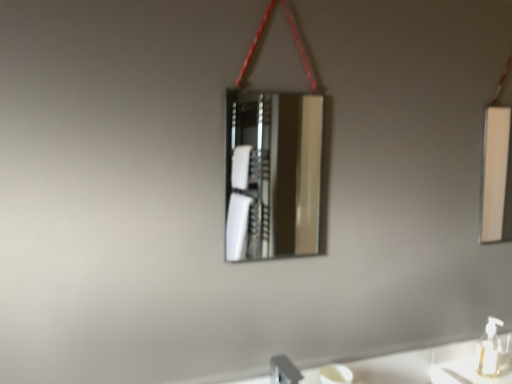
Measure the distance between silver metallic faucet at lower center and camera.

The distance of silver metallic faucet at lower center from camera is 3.58 feet.

What do you see at coordinates (490, 351) in the screenshot? Image resolution: width=512 pixels, height=384 pixels. I see `white plastic soap dispenser at lower right` at bounding box center [490, 351].

Find the location of `polished silver mirror at center, which ranks as the first mirror in front-to-back order`. polished silver mirror at center, which ranks as the first mirror in front-to-back order is located at coordinates (272, 174).

Are white glossy mirror at right, the 1th mirror when ordered from back to front, and silver metallic faucet at lower center beside each other?

No, white glossy mirror at right, the 1th mirror when ordered from back to front, is not in contact with silver metallic faucet at lower center.

Is white glossy mirror at right, the 1th mirror when ordered from back to front, located outside silver metallic faucet at lower center?

Yes.

How much distance is there between white glossy mirror at right, arranged as the 2th mirror when viewed from the left, and silver metallic faucet at lower center?

white glossy mirror at right, arranged as the 2th mirror when viewed from the left, and silver metallic faucet at lower center are 2.68 meters apart from each other.

Is white glossy mirror at right, the 1th mirror when ordered from back to front, positioned with its back to silver metallic faucet at lower center?

No.

Considering the sizes of polished silver mirror at center, placed as the first mirror when sorted from left to right, and white plastic soap dispenser at lower right in the image, is polished silver mirror at center, placed as the first mirror when sorted from left to right, wider or thinner than white plastic soap dispenser at lower right?

Considering their sizes, polished silver mirror at center, placed as the first mirror when sorted from left to right, looks slimmer than white plastic soap dispenser at lower right.

Between polished silver mirror at center, the 2th mirror from the right, and white plastic soap dispenser at lower right, which one has smaller size?

white plastic soap dispenser at lower right.

Looking at this image, can you confirm if polished silver mirror at center, placed as the second mirror when sorted from back to front, is taller than white plastic soap dispenser at lower right?

Correct, polished silver mirror at center, placed as the second mirror when sorted from back to front, is much taller as white plastic soap dispenser at lower right.

Is white plastic soap dispenser at lower right not near white glossy mirror at right, the 1th mirror when ordered from back to front?

white plastic soap dispenser at lower right is positioned a significant distance from white glossy mirror at right, the 1th mirror when ordered from back to front.

Considering the positions of objects white plastic soap dispenser at lower right and white glossy mirror at right, placed as the 2th mirror when sorted from front to back, in the image provided, who is behind, white plastic soap dispenser at lower right or white glossy mirror at right, placed as the 2th mirror when sorted from front to back,?

Positioned behind is white glossy mirror at right, placed as the 2th mirror when sorted from front to back.

From a real-world perspective, which is physically below, white plastic soap dispenser at lower right or white glossy mirror at right, placed as the 2th mirror when sorted from front to back?

white plastic soap dispenser at lower right is physically lower.

Considering the points (498, 372) and (488, 195), which point is in front, point (498, 372) or point (488, 195)?

The point (498, 372) is in front.

In the image, is polished silver mirror at center, placed as the second mirror when sorted from back to front, on the left side or the right side of white glossy mirror at right, arranged as the 2th mirror when viewed from the left?

In the image, polished silver mirror at center, placed as the second mirror when sorted from back to front, appears on the left side of white glossy mirror at right, arranged as the 2th mirror when viewed from the left.

Considering the sizes of objects polished silver mirror at center, placed as the second mirror when sorted from back to front, and white glossy mirror at right, placed as the 2th mirror when sorted from front to back, in the image provided, who is shorter, polished silver mirror at center, placed as the second mirror when sorted from back to front, or white glossy mirror at right, placed as the 2th mirror when sorted from front to back,?

Standing shorter between the two is white glossy mirror at right, placed as the 2th mirror when sorted from front to back.

Which is behind, point (240, 205) or point (480, 234)?

The point (240, 205) is more distant.

Considering the relative sizes of white glossy mirror at right, the 1th mirror when ordered from back to front, and polished silver mirror at center, placed as the first mirror when sorted from left to right, in the image provided, is white glossy mirror at right, the 1th mirror when ordered from back to front, shorter than polished silver mirror at center, placed as the first mirror when sorted from left to right,?

Yes.

Considering the relative positions of white glossy mirror at right, arranged as the 2th mirror when viewed from the left, and polished silver mirror at center, placed as the second mirror when sorted from back to front, in the image provided, is white glossy mirror at right, arranged as the 2th mirror when viewed from the left, to the left or to the right of polished silver mirror at center, placed as the second mirror when sorted from back to front,?

In the image, white glossy mirror at right, arranged as the 2th mirror when viewed from the left, appears on the right side of polished silver mirror at center, placed as the second mirror when sorted from back to front.

Is polished silver mirror at center, which ranks as the first mirror in front-to-back order, completely or partially inside white glossy mirror at right, the 1th mirror when ordered from back to front?

No.

From the image's perspective, which one is positioned lower, white glossy mirror at right, placed as the 2th mirror when sorted from front to back, or white plastic soap dispenser at lower right?

white plastic soap dispenser at lower right, from the image's perspective.

Which object is further away from the camera taking this photo, white glossy mirror at right, placed as the 2th mirror when sorted from front to back, or white plastic soap dispenser at lower right?

white glossy mirror at right, placed as the 2th mirror when sorted from front to back.

In the scene shown: Is white glossy mirror at right, placed as the first mirror when sorted from right to left, placed right next to white plastic soap dispenser at lower right?

No, white glossy mirror at right, placed as the first mirror when sorted from right to left, is not with white plastic soap dispenser at lower right.

Looking at this image, is white glossy mirror at right, arranged as the 2th mirror when viewed from the left, facing towards white plastic soap dispenser at lower right?

No, white glossy mirror at right, arranged as the 2th mirror when viewed from the left, does not turn towards white plastic soap dispenser at lower right.

Identify the location of soap dispenser positioned vertically above the silver metallic faucet at lower center (from a real-world perspective). (490, 351).

How much distance is there between silver metallic faucet at lower center and white plastic soap dispenser at lower right?

24.01 inches.

Does silver metallic faucet at lower center have a lesser height compared to white plastic soap dispenser at lower right?

Correct, silver metallic faucet at lower center is not as tall as white plastic soap dispenser at lower right.

From the image's perspective, which object appears higher, silver metallic faucet at lower center or white plastic soap dispenser at lower right?

From the image's view, white plastic soap dispenser at lower right is above.

Find the location of a particular element. This screenshot has height=384, width=512. faucet to the left of white glossy mirror at right, placed as the first mirror when sorted from right to left is located at coordinates (283, 371).

Locate an element on the screen. The image size is (512, 384). the 1st mirror above the white plastic soap dispenser at lower right (from a real-world perspective) is located at coordinates (272, 174).

Based on their spatial positions, is white plastic soap dispenser at lower right or white glossy mirror at right, the 1th mirror when ordered from back to front, closer to polished silver mirror at center, placed as the first mirror when sorted from left to right?

Among the two, white glossy mirror at right, the 1th mirror when ordered from back to front, is located nearer to polished silver mirror at center, placed as the first mirror when sorted from left to right.

Which object lies nearer to the anchor point white glossy mirror at right, arranged as the 2th mirror when viewed from the left, white plastic soap dispenser at lower right or silver metallic faucet at lower center?

Among the two, white plastic soap dispenser at lower right is located nearer to white glossy mirror at right, arranged as the 2th mirror when viewed from the left.

Which object lies further to the anchor point white plastic soap dispenser at lower right, polished silver mirror at center, the 2th mirror from the right, or silver metallic faucet at lower center?

Based on the image, polished silver mirror at center, the 2th mirror from the right, appears to be further to white plastic soap dispenser at lower right.

When comparing their distances from white plastic soap dispenser at lower right, does silver metallic faucet at lower center or white glossy mirror at right, the 1th mirror when ordered from back to front, seem further?

white glossy mirror at right, the 1th mirror when ordered from back to front, is positioned further to the anchor white plastic soap dispenser at lower right.

Consider the image. Based on their spatial positions, is polished silver mirror at center, which ranks as the first mirror in front-to-back order, or silver metallic faucet at lower center further from white glossy mirror at right, arranged as the 2th mirror when viewed from the left?

silver metallic faucet at lower center is positioned further to the anchor white glossy mirror at right, arranged as the 2th mirror when viewed from the left.

From the image, which object appears to be nearer to silver metallic faucet at lower center, white glossy mirror at right, placed as the 2th mirror when sorted from front to back, or white plastic soap dispenser at lower right?

Among the two, white plastic soap dispenser at lower right is located nearer to silver metallic faucet at lower center.

Based on their spatial positions, is polished silver mirror at center, placed as the first mirror when sorted from left to right, or white plastic soap dispenser at lower right closer to silver metallic faucet at lower center?

Based on the image, white plastic soap dispenser at lower right appears to be nearer to silver metallic faucet at lower center.

From the image, which object appears to be farther from white plastic soap dispenser at lower right, white glossy mirror at right, placed as the 2th mirror when sorted from front to back, or silver metallic faucet at lower center?

Based on the image, white glossy mirror at right, placed as the 2th mirror when sorted from front to back, appears to be further to white plastic soap dispenser at lower right.

Where is `soap dispenser situated between silver metallic faucet at lower center and white glossy mirror at right, placed as the first mirror when sorted from right to left, from left to right`? The width and height of the screenshot is (512, 384). soap dispenser situated between silver metallic faucet at lower center and white glossy mirror at right, placed as the first mirror when sorted from right to left, from left to right is located at coordinates (490, 351).

This screenshot has height=384, width=512. In order to click on faucet between polished silver mirror at center, the 2th mirror from the right, and white plastic soap dispenser at lower right from left to right in this screenshot , I will do `click(283, 371)`.

The width and height of the screenshot is (512, 384). I want to click on soap dispenser situated between polished silver mirror at center, placed as the second mirror when sorted from back to front, and white glossy mirror at right, arranged as the 2th mirror when viewed from the left, from left to right, so click(x=490, y=351).

Image resolution: width=512 pixels, height=384 pixels. I want to click on faucet situated between polished silver mirror at center, placed as the first mirror when sorted from left to right, and white glossy mirror at right, the 1th mirror when ordered from back to front, from left to right, so click(283, 371).